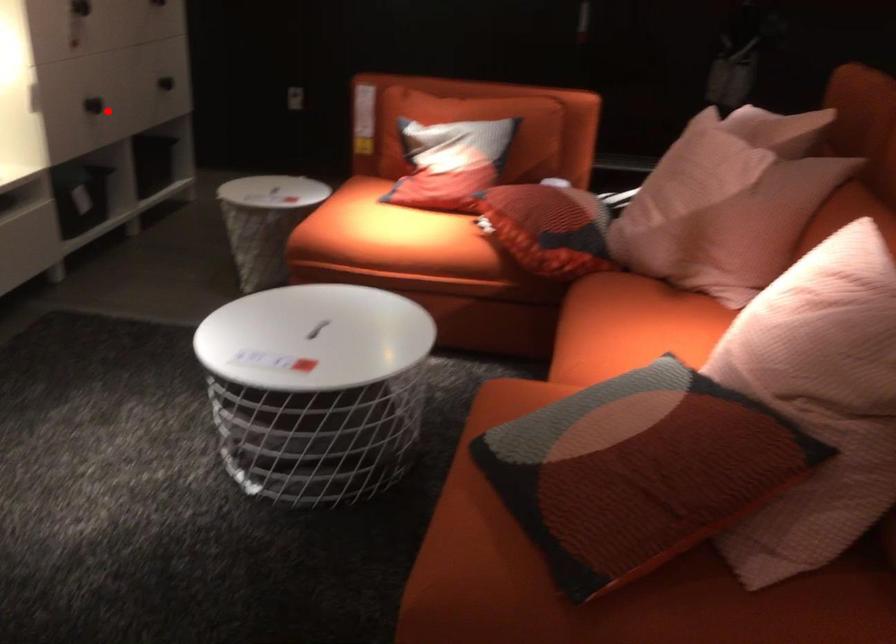
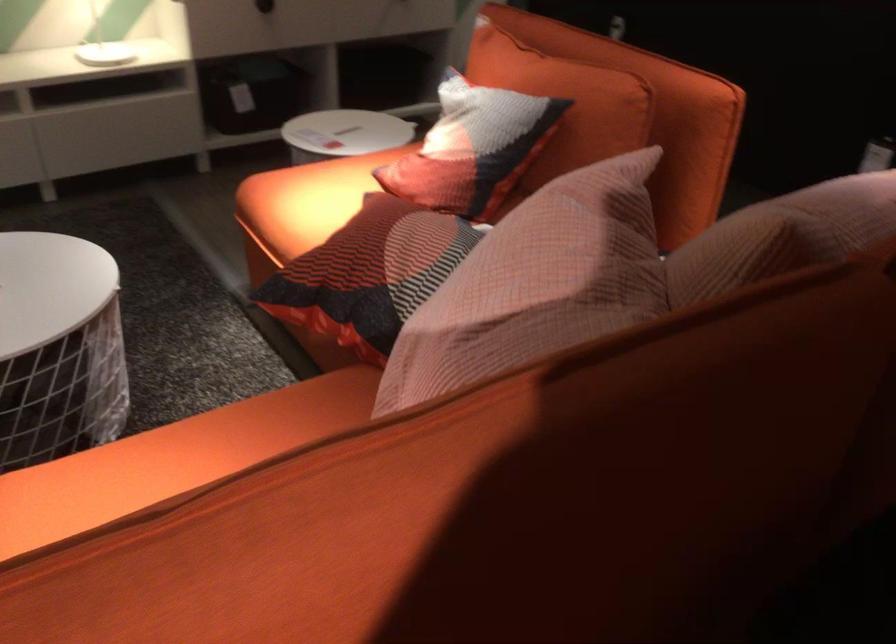
Locate, in the second image, the point that corresponds to the highlighted location in the first image.

(264, 6)